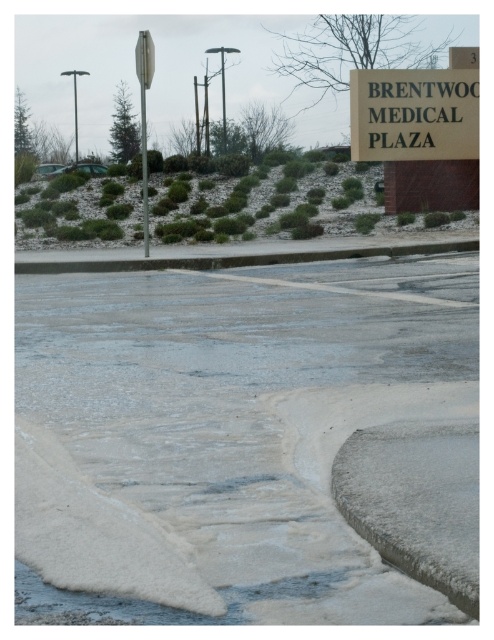
You are a delivery person who needs to avoid slipping on ice. You see the white frosted puddle at lower center and the metallic reflective street sign at upper center. How far apart are these two objects?

The white frosted puddle at lower center and the metallic reflective street sign at upper center are 9.56 meters apart from each other.

You are a delivery driver approaching the Brentwood Medical Plaza and need to read both the white plastic sign at upper center and the metallic reflective street sign at upper center. Which sign is shorter in height?

The white plastic sign at upper center is shorter in height compared to the metallic reflective street sign at upper center.